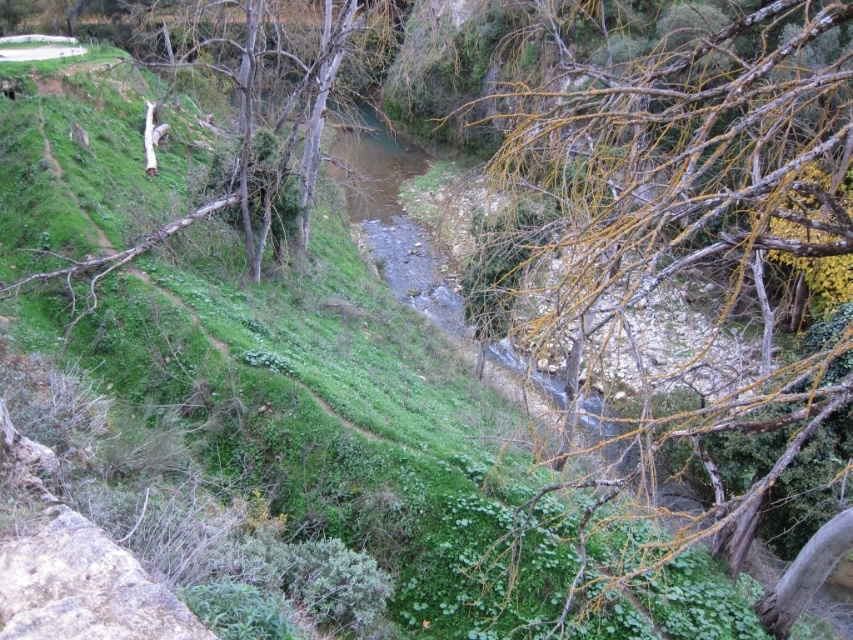
Is yellowish-brown branches at center shorter than brown wood tree at upper left?

A: No.

Which is more to the left, yellowish-brown branches at center or brown wood tree at upper left?

brown wood tree at upper left

Measure the distance between yellowish-brown branches at center and camera.

5.71 meters

Where is `yellowish-brown branches at center`? Image resolution: width=853 pixels, height=640 pixels. yellowish-brown branches at center is located at coordinates coord(654,192).